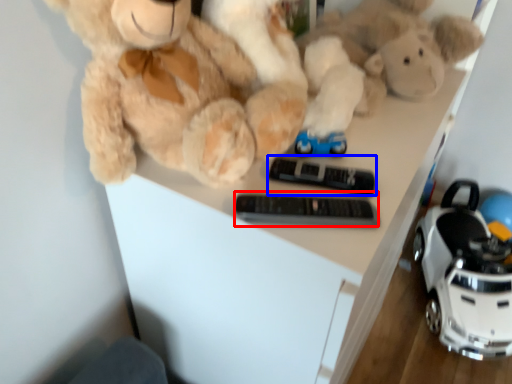
Question: Which point is closer to the camera, control (highlighted by a red box) or control (highlighted by a blue box)?

Choices:
 (A) control
 (B) control

Answer: (A)